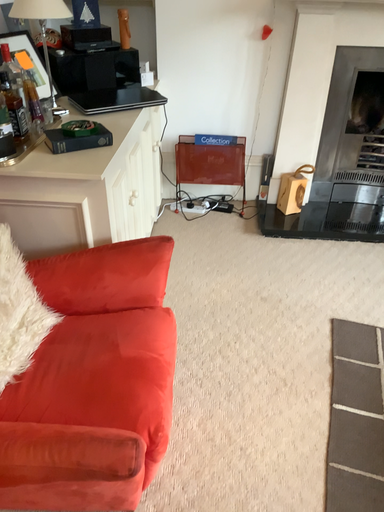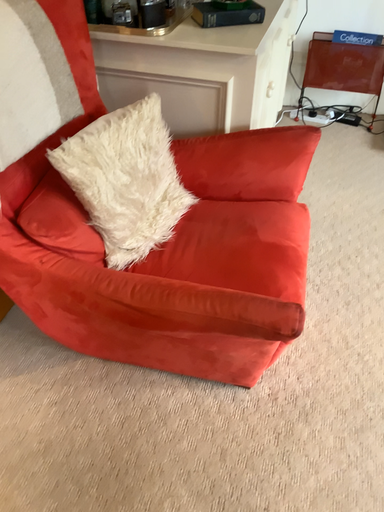
Question: Which way did the camera rotate in the video?

Choices:
 (A) rotated left
 (B) rotated right

Answer: (A)